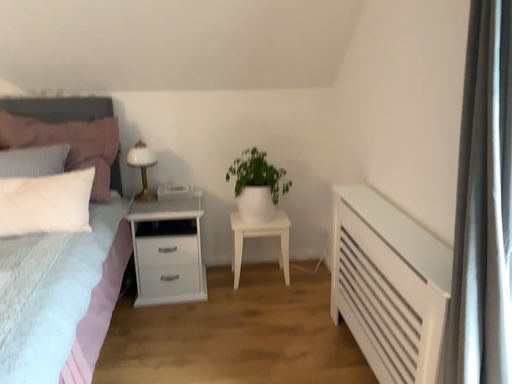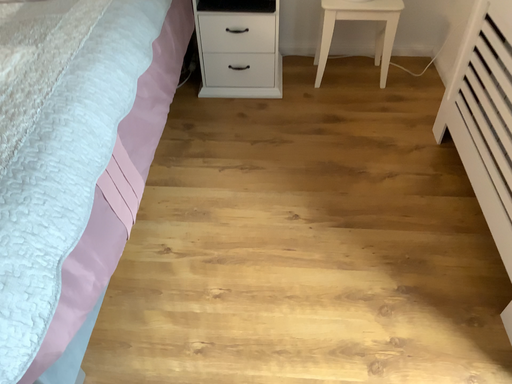
Question: Which way did the camera rotate in the video?

Choices:
 (A) rotated upward
 (B) rotated downward

Answer: (B)